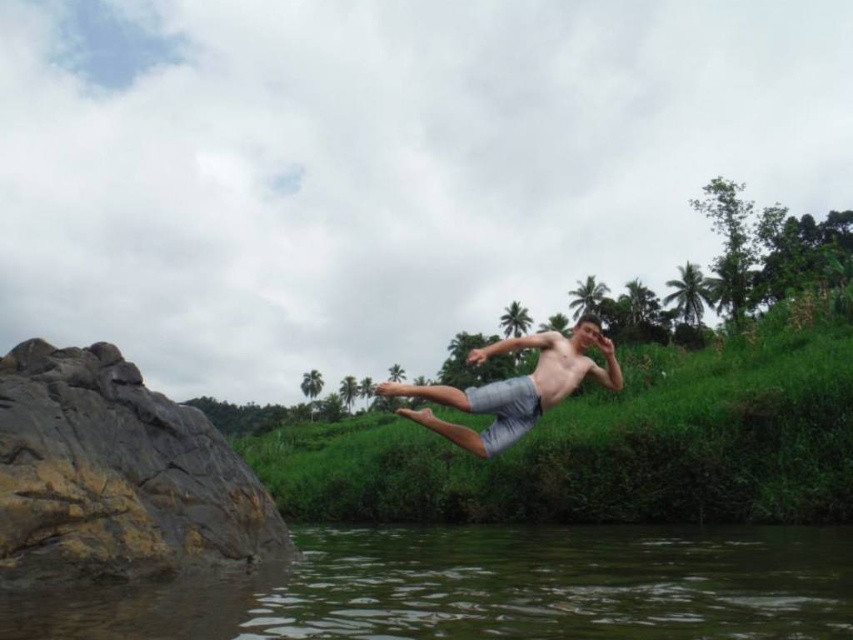
Question: Can you confirm if greenish-brown water at lower center is positioned above brown rough rock at left?

Choices:
 (A) no
 (B) yes

Answer: (A)

Question: Which is farther from the greenish-brown water at lower center?

Choices:
 (A) brown rough rock at left
 (B) gray cotton shorts at center

Answer: (A)

Question: Which of the following is the farthest from the observer?

Choices:
 (A) (167, 595)
 (B) (509, 435)

Answer: (B)

Question: Considering the relative positions of greenish-brown water at lower center and gray cotton shorts at center in the image provided, where is greenish-brown water at lower center located with respect to gray cotton shorts at center?

Choices:
 (A) below
 (B) above

Answer: (A)

Question: Which object is closer to the camera taking this photo?

Choices:
 (A) greenish-brown water at lower center
 (B) brown rough rock at left

Answer: (A)

Question: From the image, what is the correct spatial relationship of greenish-brown water at lower center in relation to gray cotton shorts at center?

Choices:
 (A) below
 (B) above

Answer: (A)